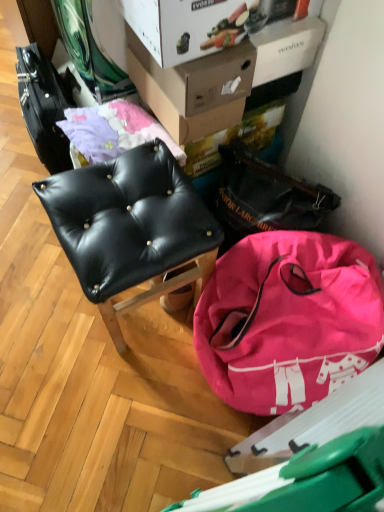
Question: Which direction should I rotate to look at cardboard box at upper center, which ranks as the 2th cardboard box in front-to-back order?

Choices:
 (A) right
 (B) left

Answer: (A)

Question: From a real-world perspective, does pink fabric bag at lower right sit lower than cardboard box at upper center, which ranks as the 2th cardboard box in front-to-back order?

Choices:
 (A) yes
 (B) no

Answer: (A)

Question: From the image's perspective, is pink fabric bag at lower right located beneath cardboard box at upper center, arranged as the 1th cardboard box when viewed from the back?

Choices:
 (A) yes
 (B) no

Answer: (A)

Question: Is pink fabric bag at lower right further to camera compared to cardboard box at upper center, which ranks as the 2th cardboard box in front-to-back order?

Choices:
 (A) no
 (B) yes

Answer: (A)

Question: Is pink fabric bag at lower right placed right next to cardboard box at upper center, which ranks as the 2th cardboard box in front-to-back order?

Choices:
 (A) yes
 (B) no

Answer: (B)

Question: Is pink fabric bag at lower right taller than cardboard box at upper center, which ranks as the 2th cardboard box in front-to-back order?

Choices:
 (A) yes
 (B) no

Answer: (A)

Question: Is pink fabric bag at lower right at the left side of cardboard box at upper center, which ranks as the 2th cardboard box in front-to-back order?

Choices:
 (A) no
 (B) yes

Answer: (A)

Question: Is white cardboard box at upper center, which is counted as the 1th cardboard box, starting from the front, positioned beyond the bounds of black leather messenger bag at upper right?

Choices:
 (A) yes
 (B) no

Answer: (A)

Question: Is black leather messenger bag at upper right surrounded by white cardboard box at upper center, which is counted as the 1th cardboard box, starting from the front?

Choices:
 (A) yes
 (B) no

Answer: (B)

Question: Are white cardboard box at upper center, which is counted as the 1th cardboard box, starting from the front, and black leather messenger bag at upper right located far from each other?

Choices:
 (A) no
 (B) yes

Answer: (A)

Question: From a real-world perspective, does white cardboard box at upper center, the second cardboard box when ordered from back to front, stand above black leather messenger bag at upper right?

Choices:
 (A) no
 (B) yes

Answer: (B)

Question: Does white cardboard box at upper center, the second cardboard box when ordered from back to front, have a smaller size compared to black leather messenger bag at upper right?

Choices:
 (A) yes
 (B) no

Answer: (A)

Question: Can you confirm if white cardboard box at upper center, the second cardboard box when ordered from back to front, is positioned to the right of black leather messenger bag at upper right?

Choices:
 (A) no
 (B) yes

Answer: (A)

Question: Is white cardboard box at upper center, the second cardboard box when ordered from back to front, wider than pink fabric bag at lower right?

Choices:
 (A) no
 (B) yes

Answer: (A)